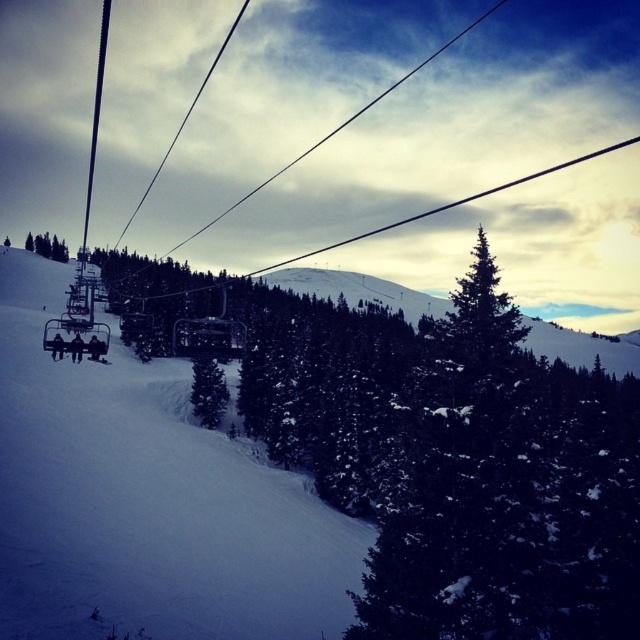
Is point (442, 593) closer to viewer compared to point (212, 412)?

Yes, it is.

Who is positioned more to the left, green textured pine tree at center or green matte tree at center?

green matte tree at center

Between point (454, 540) and point (204, 404), which one is positioned behind?

Positioned behind is point (204, 404).

At what (x,y) coordinates should I click in order to perform the action: click on green textured pine tree at center. Please return your answer as a coordinate pair (x, y). Looking at the image, I should click on (506, 490).

Can you confirm if green matte tree at center is positioned above green matte tree at upper left?

Incorrect, green matte tree at center is not positioned above green matte tree at upper left.

Looking at this image, which is more to the right, green matte tree at center or green matte tree at upper left?

From the viewer's perspective, green matte tree at center appears more on the right side.

Is point (211, 420) closer to viewer compared to point (54, 248)?

Yes, it is.

The width and height of the screenshot is (640, 640). I want to click on green matte tree at center, so click(x=209, y=392).

Between white snow at center and green matte tree at upper left, which one has less height?

Standing shorter between the two is white snow at center.

Who is more forward, (32, 598) or (29, 234)?

Point (32, 598) is in front.

I want to click on white snow at center, so click(x=147, y=500).

This screenshot has height=640, width=640. I want to click on white snow at center, so click(x=147, y=500).